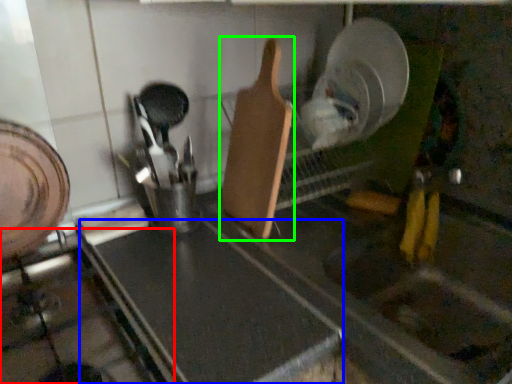
Question: Which object is the farthest from gas stove (highlighted by a red box)? Choose among these: counter top (highlighted by a blue box) or spatula (highlighted by a green box).

Choices:
 (A) counter top
 (B) spatula

Answer: (B)